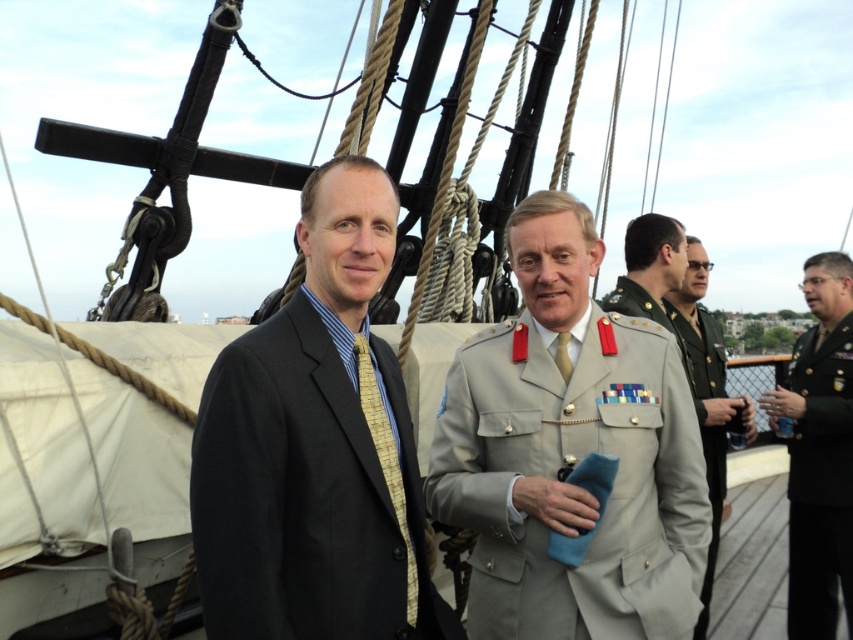
You are a photographer who needs to capture a photo of both the dark green military uniform at right and the yellowstriped fabrictie at left. Since you want both subjects to appear equally sized in the photo, which one should you move closer to the camera?

The dark green military uniform at right is taller than the yellowstriped fabrictie at left. To make them appear equally sized in the photo, you should move closer to the taller subject, which is the dark green military uniform at right, so that it appears smaller in the frame.

Looking at this image, you are a photographer trying to capture a clear shot of both the yellowstriped fabrictie at left and the yellow silk tie at center. Since you want to ensure both are visible in the frame, which one should you focus on first to account for their size difference?

The yellowstriped fabrictie at left is much taller than the yellow silk tie at center, so you should focus on the yellowstriped fabrictie at left first to ensure it fits properly in the frame before adjusting for the smaller yellow silk tie at center.